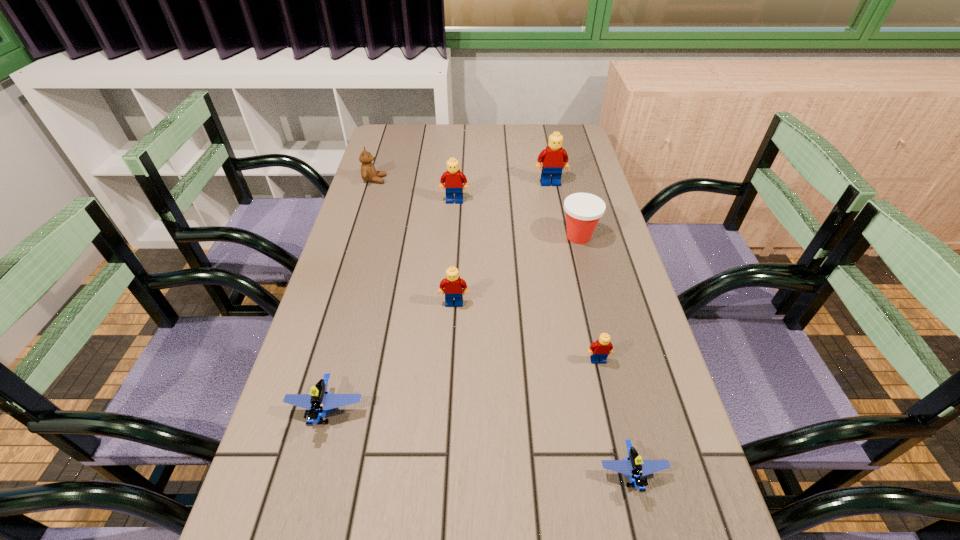
This screenshot has width=960, height=540. What are the coordinates of `free point between the third smallest yellow Lego and the teddy bear` in the screenshot? It's located at (415, 191).

Find the location of a particular element. This screenshot has height=540, width=960. free space between the fifth shortest Lego and the third biggest yellow Lego is located at coordinates coord(454,252).

Where is `vacant region between the nearest object and the left blue Lego`? vacant region between the nearest object and the left blue Lego is located at coordinates (479, 442).

Locate an element on the screen. The width and height of the screenshot is (960, 540). free spot between the tallest Lego and the third smallest yellow Lego is located at coordinates (502, 192).

Find the location of a particular element. Image resolution: width=960 pixels, height=540 pixels. free area in between the fourth nearest object and the tallest object is located at coordinates (502, 243).

Identify the location of empty location between the bigger blue Lego and the fifth nearest object. This screenshot has height=540, width=960. (453, 324).

Identify the location of empty location between the teddy bear and the leftmost Lego. The height and width of the screenshot is (540, 960). coord(350,295).

Identify the location of object that is the fourth closest to the Dixie cup. (599, 350).

This screenshot has width=960, height=540. In order to click on the second closest object relative to the farther blue Lego in this screenshot , I will do `click(633, 465)`.

Where is `Lego that is the closest one to the second nearest object`? This screenshot has height=540, width=960. Lego that is the closest one to the second nearest object is located at coordinates (453, 286).